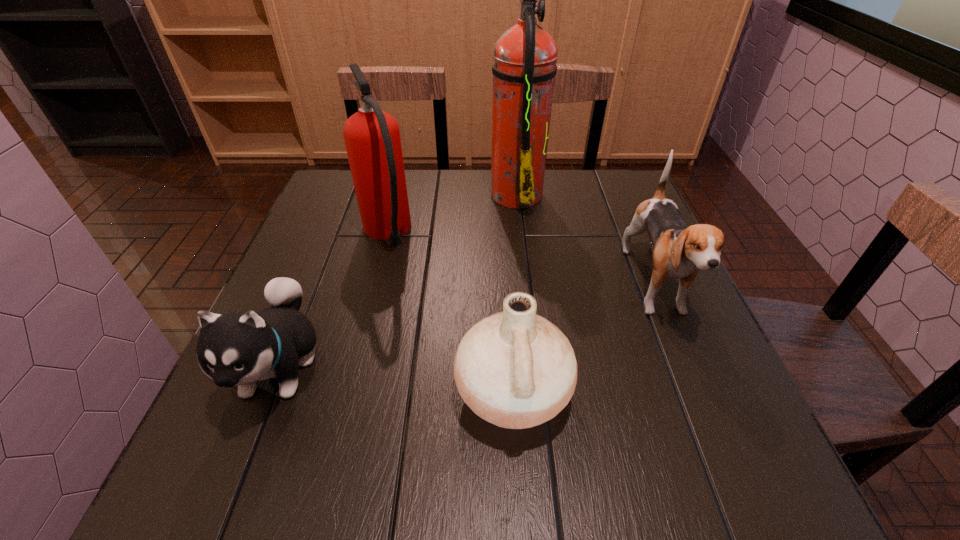
You are a GUI agent. You are given a task and a screenshot of the screen. Output one action in this format:
    pyautogui.click(x=<x>, y=<y>)
    Task: Click on the vacant space located 0.210m at the nozzle of the tallest object
    The height and width of the screenshot is (540, 960).
    Given the screenshot: What is the action you would take?
    pyautogui.click(x=416, y=193)

What are the coordinates of `vacant space located 0.240m at the nozzle of the tallest object` in the screenshot? It's located at pyautogui.click(x=405, y=193).

Image resolution: width=960 pixels, height=540 pixels. I want to click on free space located 0.090m on the handle side of the fourth shortest object, so click(x=398, y=191).

The width and height of the screenshot is (960, 540). Find the location of `vacant region located on the handle side of the fourth shortest object`. vacant region located on the handle side of the fourth shortest object is located at coordinates (402, 173).

You are a GUI agent. You are given a task and a screenshot of the screen. Output one action in this format:
    pyautogui.click(x=<x>, y=<y>)
    Task: Click on the vacant space positioned 0.060m on the handle side of the fourth shortest object
    The height and width of the screenshot is (540, 960).
    Given the screenshot: What is the action you would take?
    pyautogui.click(x=396, y=196)

In order to click on blank area located at the face of the third tallest object in this screenshot , I will do `click(706, 408)`.

Find the location of a particular element. blank space located to pour from the handle of the pottery is located at coordinates (404, 393).

The image size is (960, 540). Identify the location of vacant area situated to pour from the handle of the pottery. (228, 393).

Identify the location of vacant space positioned 0.290m to pour from the handle of the pottery. The image size is (960, 540). (291, 393).

Find the location of a particular element. free space located at the face of the left puppy is located at coordinates (233, 483).